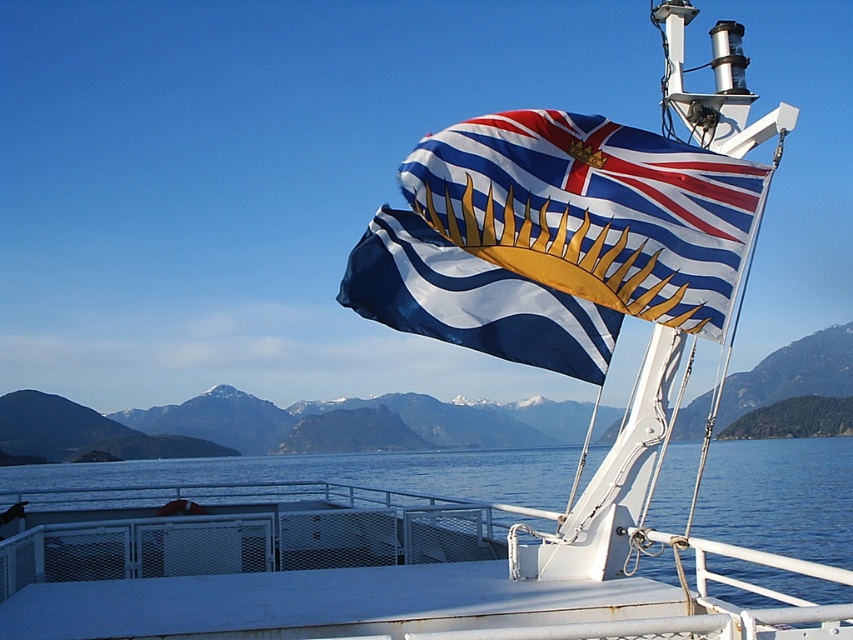
Can you confirm if blue and white striped flag at upper center is bigger than blue water at center?

No.

Is blue and white striped flag at upper center above blue water at center?

Indeed, blue and white striped flag at upper center is positioned over blue water at center.

Is point (544, 124) farther from viewer compared to point (30, 500)?

No, (544, 124) is closer to viewer.

Identify the location of blue and white striped flag at upper center. (555, 237).